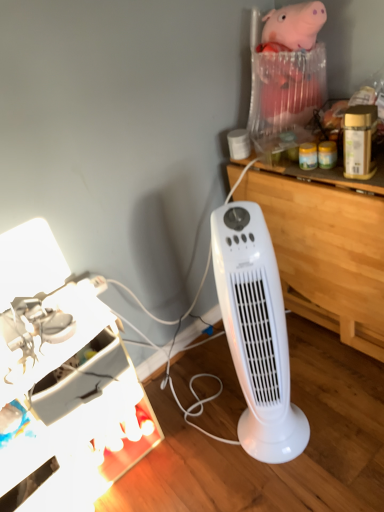
Locate an element on the screen. vacant region in front of white plastic tower fan at center is located at coordinates (298, 483).